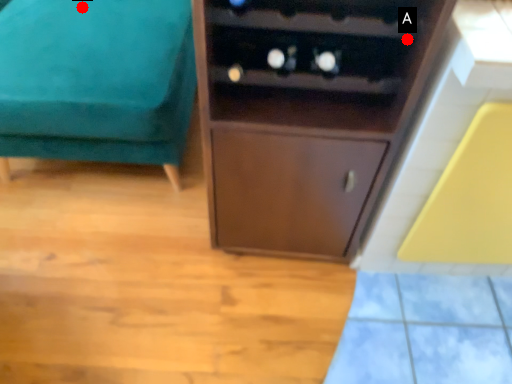
Question: Two points are circled on the image, labeled by A and B beside each circle. Which point is farther to the camera?

Choices:
 (A) A is further
 (B) B is further

Answer: (B)